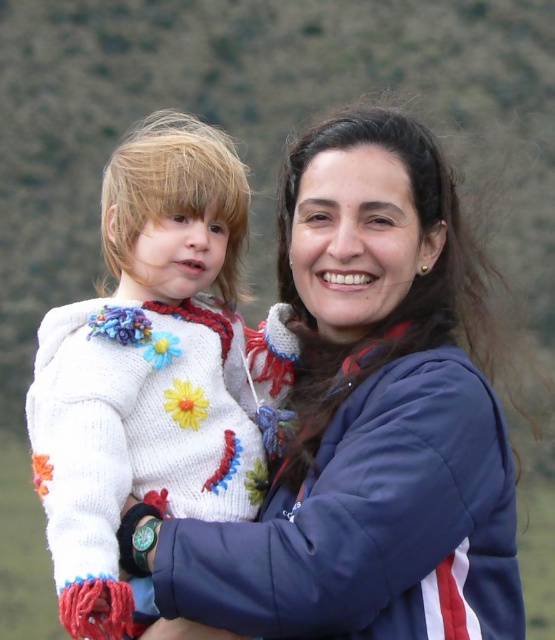
Which is above, matte blue jacket at center or white knitted sweater at left?

Positioned higher is white knitted sweater at left.

Between matte blue jacket at center and white knitted sweater at left, which one appears on the left side from the viewer's perspective?

From the viewer's perspective, white knitted sweater at left appears more on the left side.

Locate an element on the screen. matte blue jacket at center is located at coordinates (365, 419).